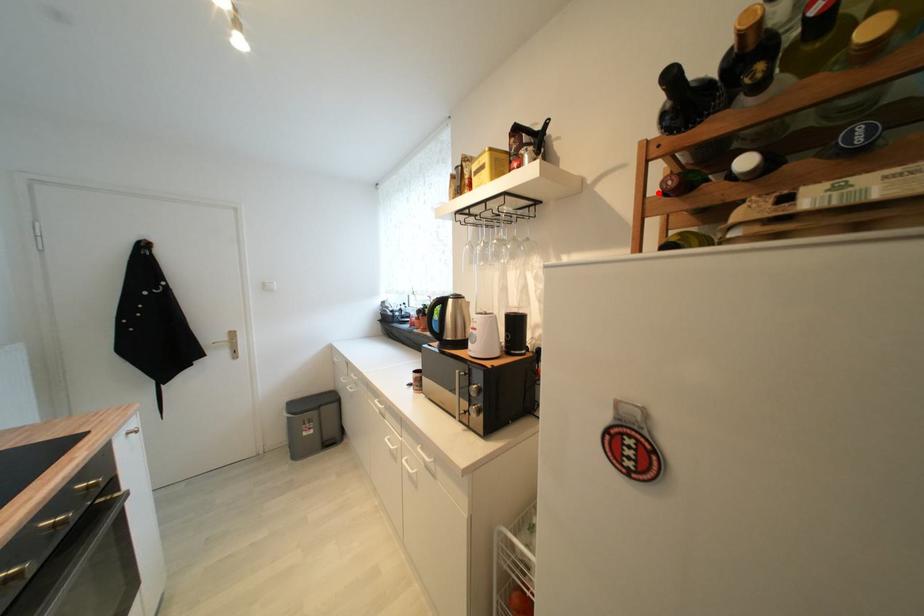
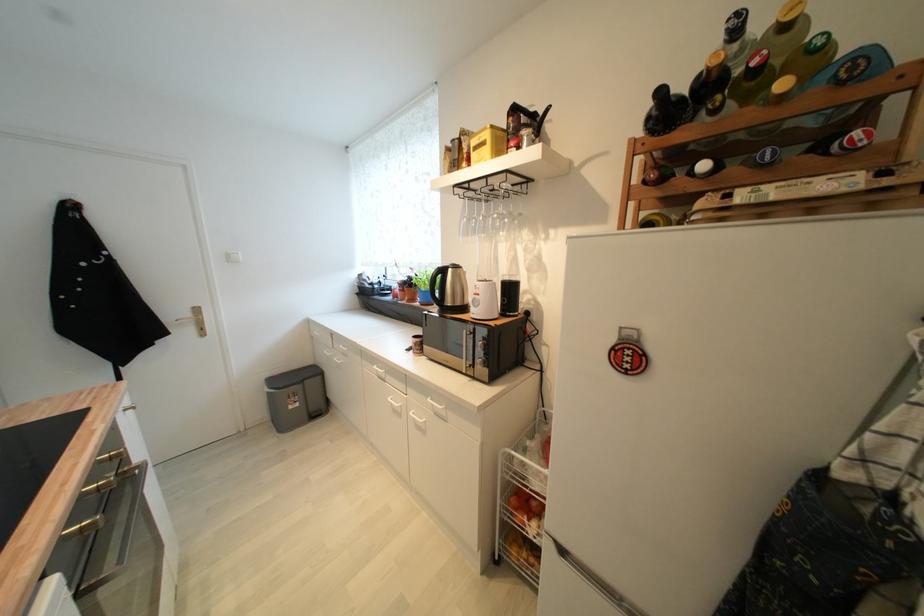
The point at the highlighted location is marked in the first image. Where is the corresponding point in the second image?

(641, 182)